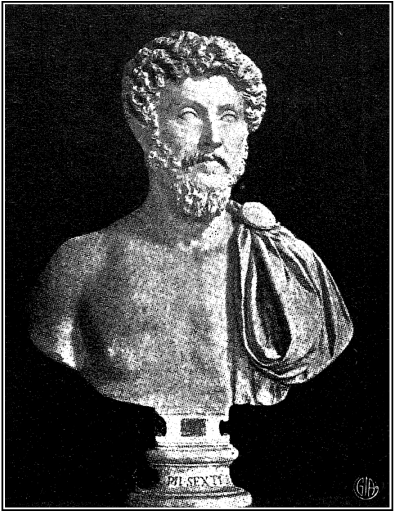
Locate an element on the screen. bust is located at coordinates (186, 328).